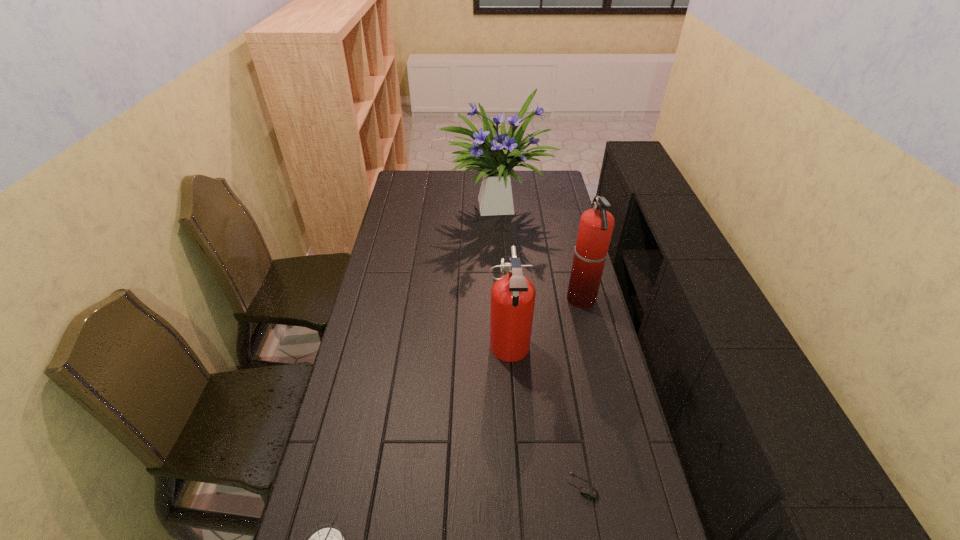
Find the location of `vacant position located with the nozzle and gauge on the second farthest object`. vacant position located with the nozzle and gauge on the second farthest object is located at coordinates (553, 300).

Locate an element on the screen. blank space located 0.350m on the front of the left fire extinguisher is located at coordinates 517,495.

You are a GUI agent. You are given a task and a screenshot of the screen. Output one action in this format:
    pyautogui.click(x=<x>, y=<y>)
    Task: Click on the vacant space positioned 0.180m on the back of the second nearest object
    The image size is (960, 540).
    Given the screenshot: What is the action you would take?
    pyautogui.click(x=569, y=411)

You are a GUI agent. You are given a task and a screenshot of the screen. Output one action in this format:
    pyautogui.click(x=<x>, y=<y>)
    Task: Click on the object present at the far edge
    Image resolution: width=960 pixels, height=540 pixels.
    Given the screenshot: What is the action you would take?
    tap(496, 155)

Locate an element on the screen. flower arrangement that is at the right edge is located at coordinates (496, 155).

Identify the location of fire extinguisher situated at the right edge. This screenshot has height=540, width=960. (596, 225).

Where is `mouse located in the right edge section of the desktop`? The width and height of the screenshot is (960, 540). mouse located in the right edge section of the desktop is located at coordinates (587, 491).

This screenshot has height=540, width=960. In order to click on object located in the far right corner section of the desktop in this screenshot , I will do `click(496, 155)`.

The width and height of the screenshot is (960, 540). In order to click on vacant space at the left edge in this screenshot , I will do `click(396, 222)`.

The image size is (960, 540). I want to click on vacant region at the right edge of the desktop, so click(x=612, y=417).